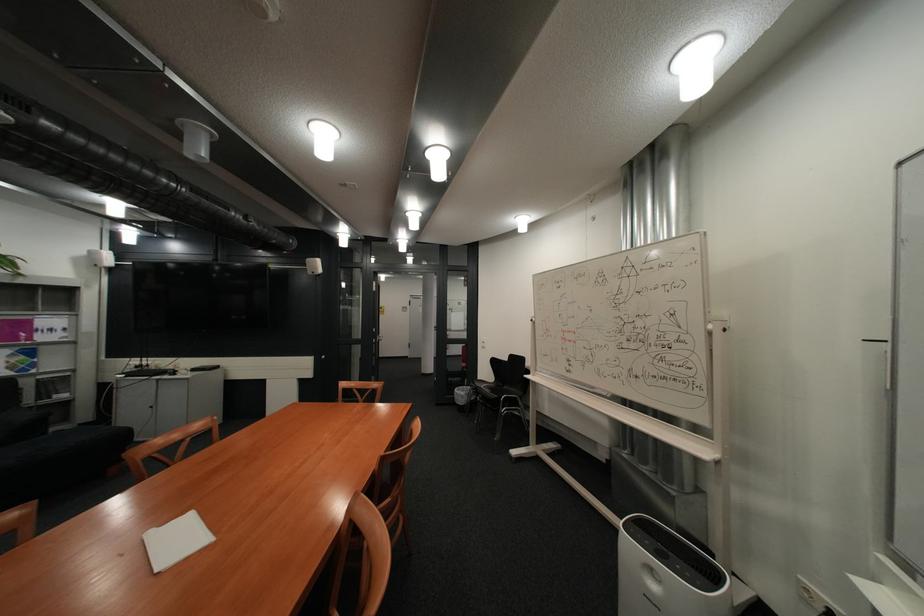
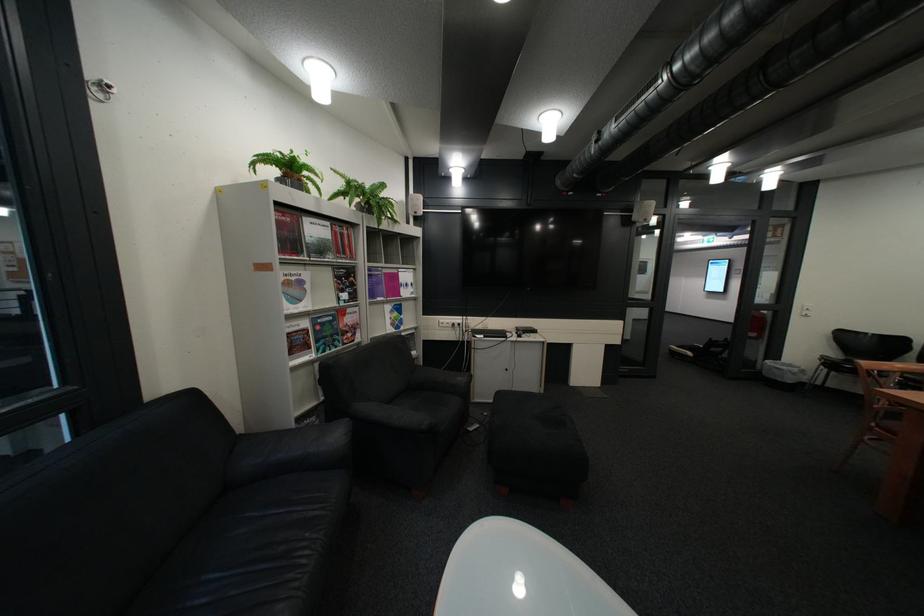
Question: The images are taken continuously from a first-person perspective. In which direction are you moving?

Choices:
 (A) Left
 (B) Right
 (C) Forward
 (D) Backward

Answer: (A)